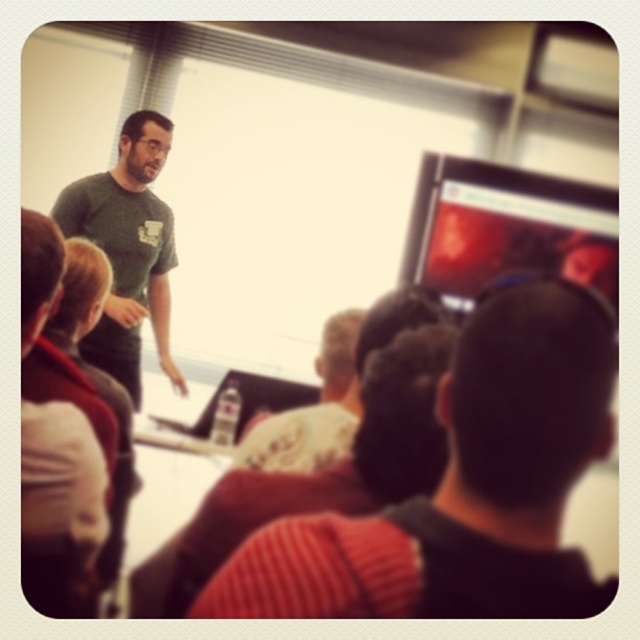
You are sitting in the classroom and want to take a photo of both point (481,390) and point (326,422). Since you want both points to be in focus, which point should you focus on first?

You should focus on point (481,390) first because it is closer to the camera than point (326,422). This ensures that when you adjust the focus for the closer point, the farther point will also be in focus due to the depth of field.

Based on the photo, you are an attendee in the classroom and want to know which clothing item is taller between the knitted red sweater at center and the white cotton shirt at center. Which one is taller?

The knitted red sweater at center is taller than the white cotton shirt at center.

From the picture: You are a photographer trying to capture a closeup of the knitted red sweater at center during the presentation. Considering the distance between the camera and the sweater, can you estimate whether the sweater will appear large or small in the photo?

The knitted red sweater at center is 22.26 inches away from the camera. Since this distance is relatively close, the sweater will likely appear large in the photo.